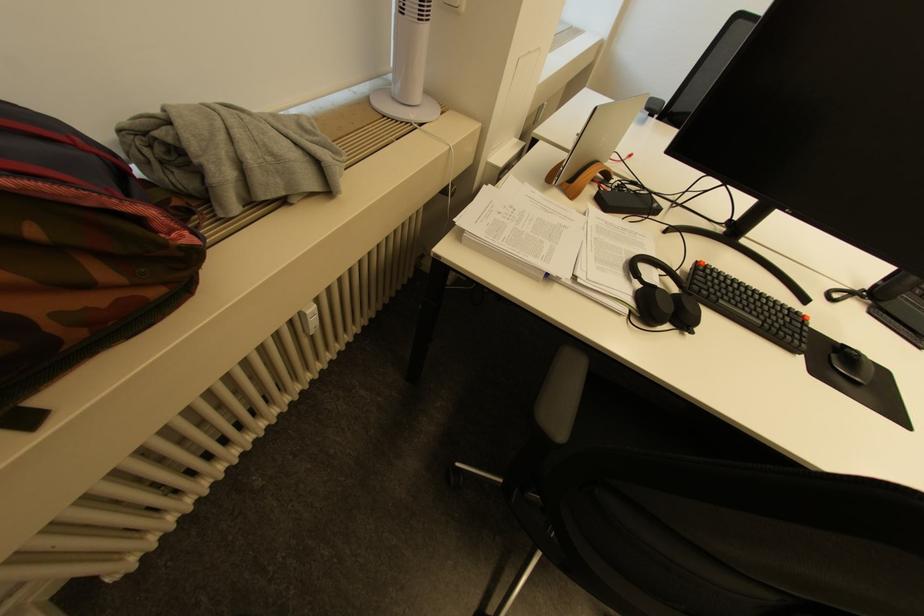
The location [78,252] corresponds to which object?

It corresponds to the camouflage backpack in the image.